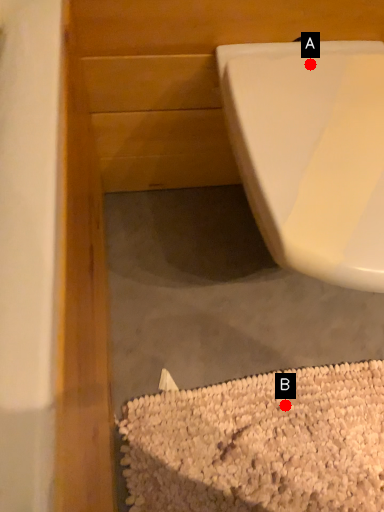
Question: Two points are circled on the image, labeled by A and B beside each circle. Which point is closer to the camera?

Choices:
 (A) A is closer
 (B) B is closer

Answer: (A)